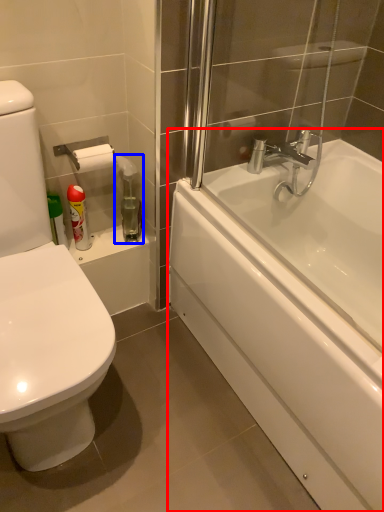
Question: Which object is closer to the camera taking this photo, bathtub (highlighted by a red box) or cleaning product (highlighted by a blue box)?

Choices:
 (A) bathtub
 (B) cleaning product

Answer: (A)